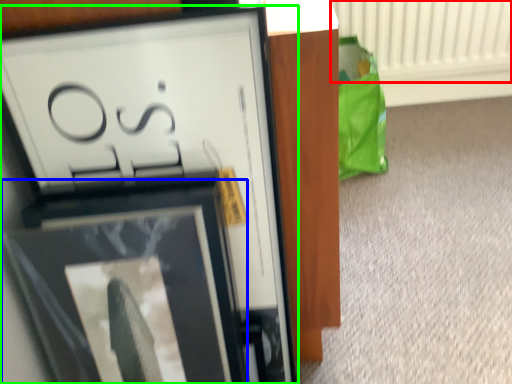
Question: Which is farther away from radiator (highlighted by a red box)? picture frame (highlighted by a blue box) or picture frame (highlighted by a green box)?

Choices:
 (A) picture frame
 (B) picture frame

Answer: (A)